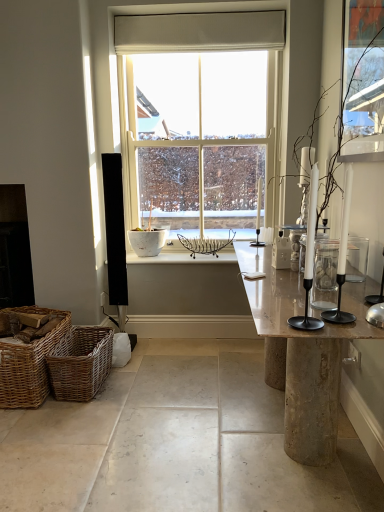
Locate an element on the screen. The height and width of the screenshot is (512, 384). blank space situated above white fabric curtain at upper center (from a real-world perspective) is located at coordinates (208, 8).